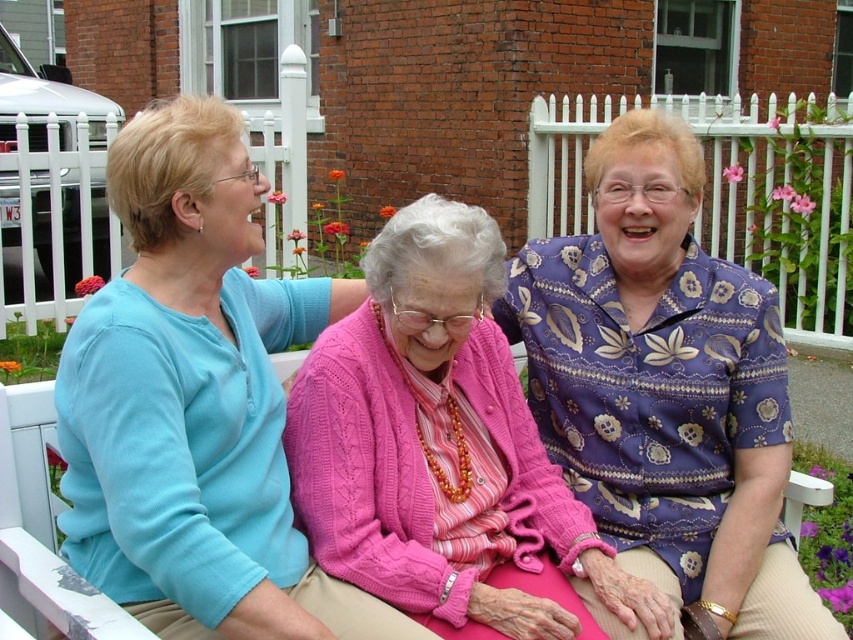
This screenshot has width=853, height=640. What do you see at coordinates (196, 403) in the screenshot?
I see `pink knitted sweater at center` at bounding box center [196, 403].

This screenshot has width=853, height=640. What do you see at coordinates (196, 403) in the screenshot? I see `pink knitted sweater at center` at bounding box center [196, 403].

I want to click on pink knitted sweater at center, so click(x=196, y=403).